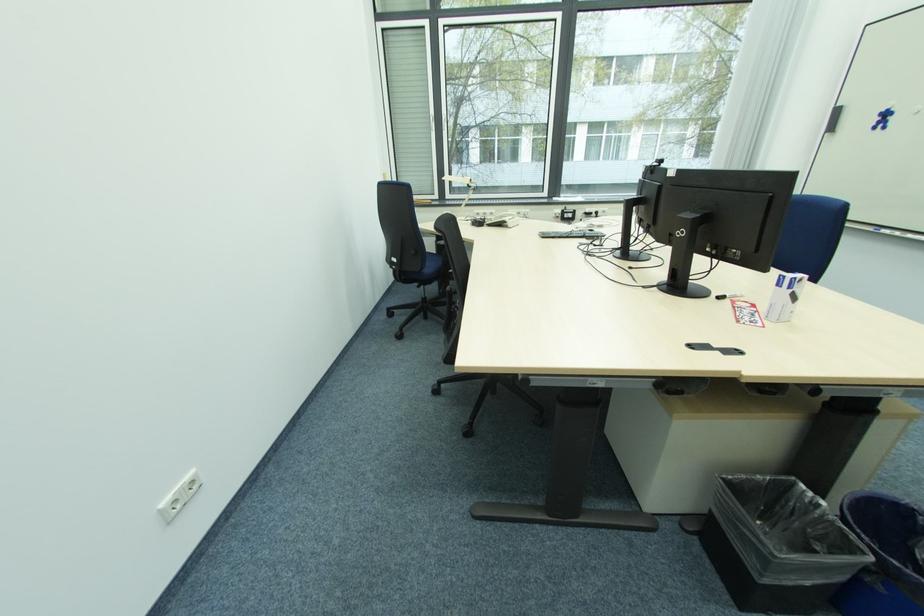
Where would you sit the blue chair sitting surface? Please return your answer as a coordinate pair (x, y).

(428, 267)